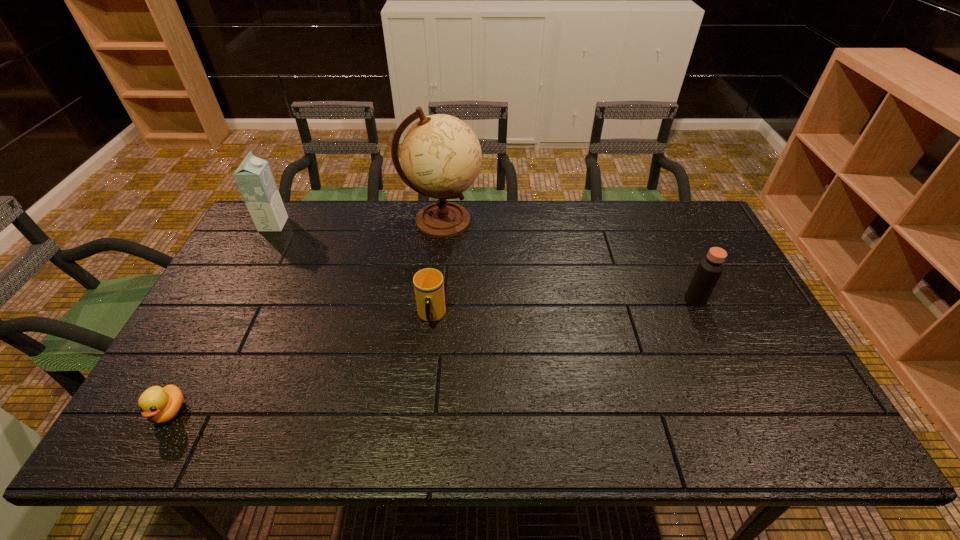
Locate an element on the screen. empty location between the cup and the rightmost object is located at coordinates (564, 308).

The image size is (960, 540). Identify the location of vacant space that's between the fourth shortest object and the nearest object. (222, 318).

I want to click on free space between the duckling and the fourth tallest object, so click(x=300, y=364).

Where is `free spot between the rightmost object and the second shortest object`? free spot between the rightmost object and the second shortest object is located at coordinates click(564, 308).

Identify which object is the nearest to the tallest object. Please provide its 2D coordinates. Your answer should be formatted as a tuple, i.e. [(x, y)], where the tuple contains the x and y coordinates of a point satisfying the conditions above.

[(428, 283)]

Identify which object is the fourth closest to the tallest object. Please provide its 2D coordinates. Your answer should be formatted as a tuple, i.e. [(x, y)], where the tuple contains the x and y coordinates of a point satisfying the conditions above.

[(159, 405)]

You are a GUI agent. You are given a task and a screenshot of the screen. Output one action in this format:
    pyautogui.click(x=<x>, y=<y>)
    Task: Click on the free space that satisfies the following two spatial constraints: 1. on the front label of the fourth shortest object; 2. on the face of the nearest object
    
    Given the screenshot: What is the action you would take?
    pyautogui.click(x=174, y=411)

Where is `blank area in the image that satisfies the following two spatial constraints: 1. on the front label of the second tallest object; 2. on the face of the duckling`? Image resolution: width=960 pixels, height=540 pixels. blank area in the image that satisfies the following two spatial constraints: 1. on the front label of the second tallest object; 2. on the face of the duckling is located at coordinates (174, 411).

At what (x,y) coordinates should I click in order to perform the action: click on free spot that satisfies the following two spatial constraints: 1. on the front label of the second tallest object; 2. on the back side of the third shortest object. Please return your answer as a coordinate pair (x, y). Image resolution: width=960 pixels, height=540 pixels. Looking at the image, I should click on (233, 299).

The width and height of the screenshot is (960, 540). Identify the location of free space that satisfies the following two spatial constraints: 1. on the surface of the globe; 2. on the face of the shortest object. (422, 411).